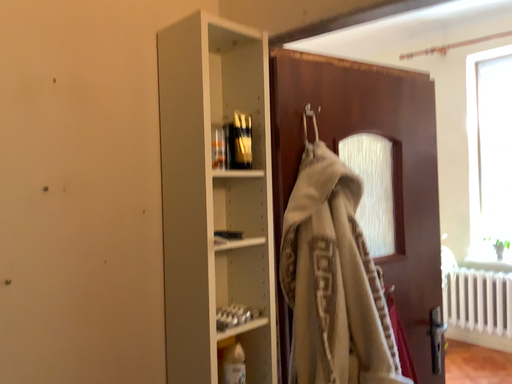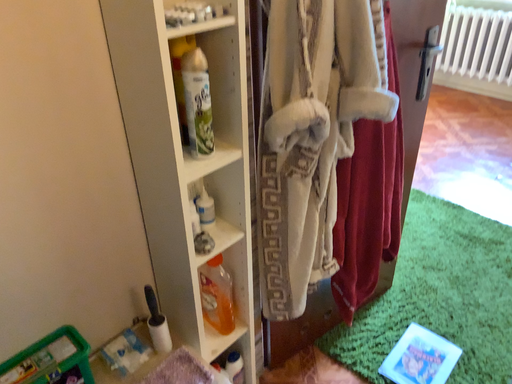
Question: Which way did the camera rotate in the video?

Choices:
 (A) rotated upward
 (B) rotated downward

Answer: (B)